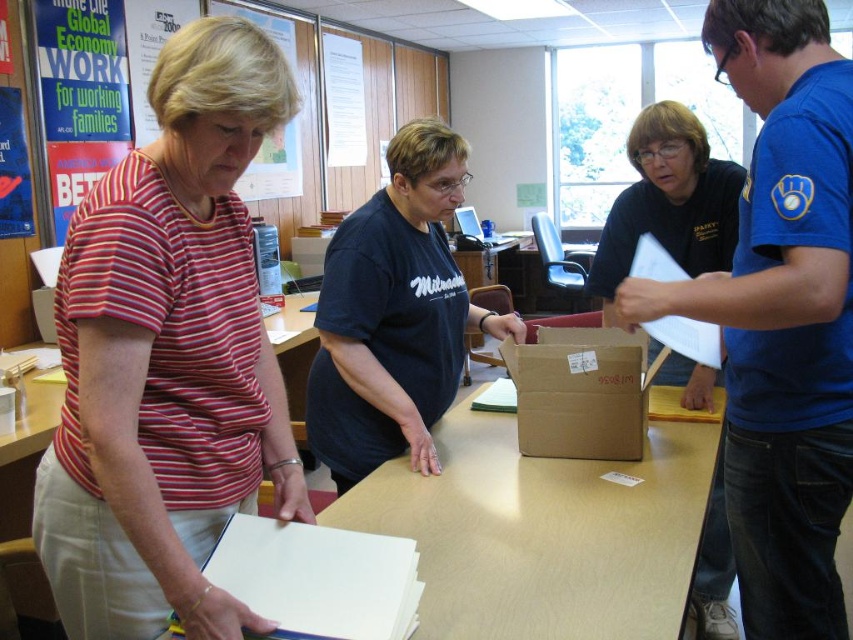
Question: Which object is the farthest from the striped cotton shirt at left?

Choices:
 (A) matte black shirt at center
 (B) blue jersey at right
 (C) brown cardboard box at center

Answer: (A)

Question: Where is matte black shirt at center located in relation to brown cardboard box at center in the image?

Choices:
 (A) above
 (B) below

Answer: (B)

Question: Estimate the real-world distances between objects in this image. Which object is farther from the matte black shirt at center?

Choices:
 (A) blue jersey at right
 (B) striped cotton shirt at left

Answer: (B)

Question: Can you confirm if matte black shirt at center is positioned to the left of brown cardboard box at center?

Choices:
 (A) no
 (B) yes

Answer: (A)

Question: Which point appears farthest from the camera in this image?

Choices:
 (A) (215, 29)
 (B) (686, 195)
 (C) (747, 554)

Answer: (B)

Question: Does striped cotton shirt at left have a greater width compared to blue jersey at right?

Choices:
 (A) yes
 (B) no

Answer: (B)